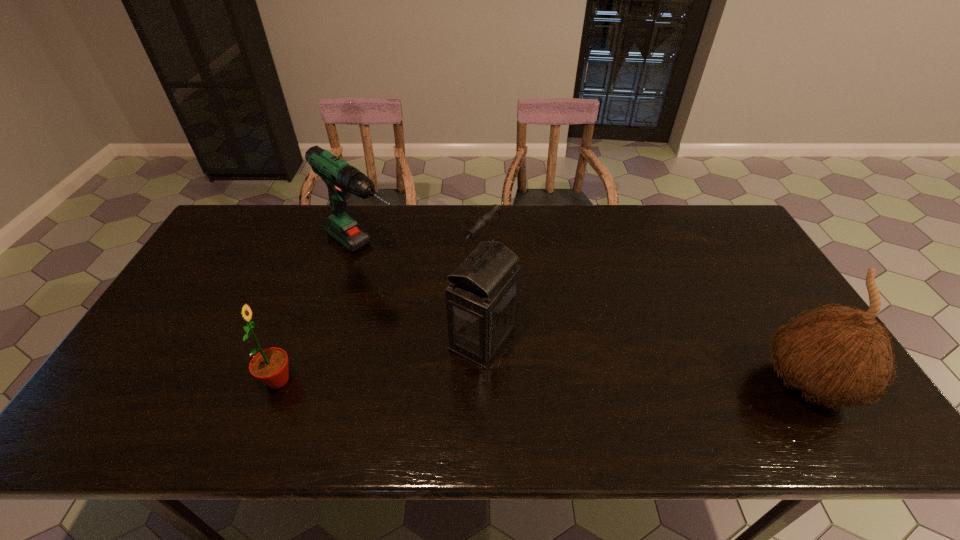
Identify the location of free space on the desktop that is between the sunflower and the coconut and is positioned on the front-facing side of the lantern. This screenshot has width=960, height=540. (573, 382).

Find the location of a particular element. This screenshot has width=960, height=540. vacant space on the desktop that is between the shortest object and the rightmost object and is positioned on the handle side of the drill is located at coordinates (534, 382).